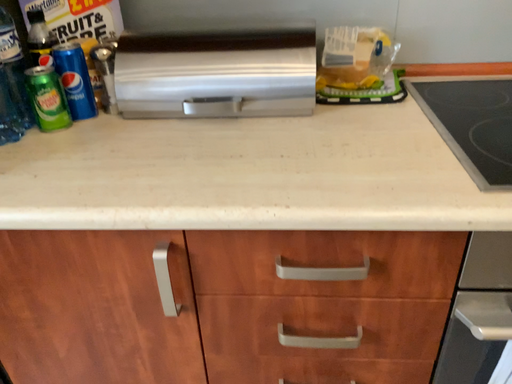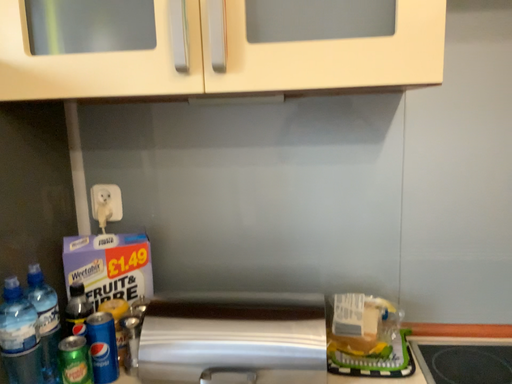
Question: Which way did the camera rotate in the video?

Choices:
 (A) rotated downward
 (B) rotated upward

Answer: (B)